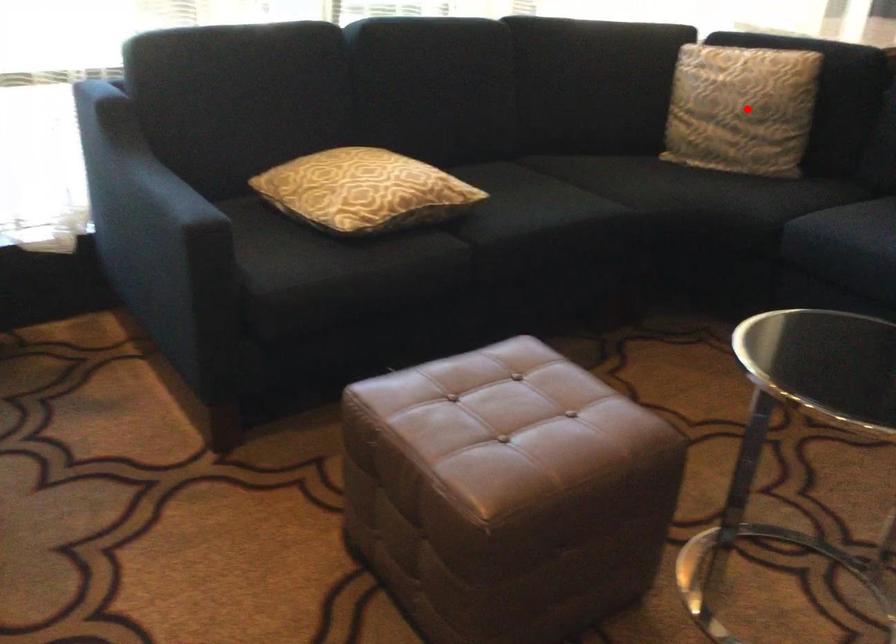
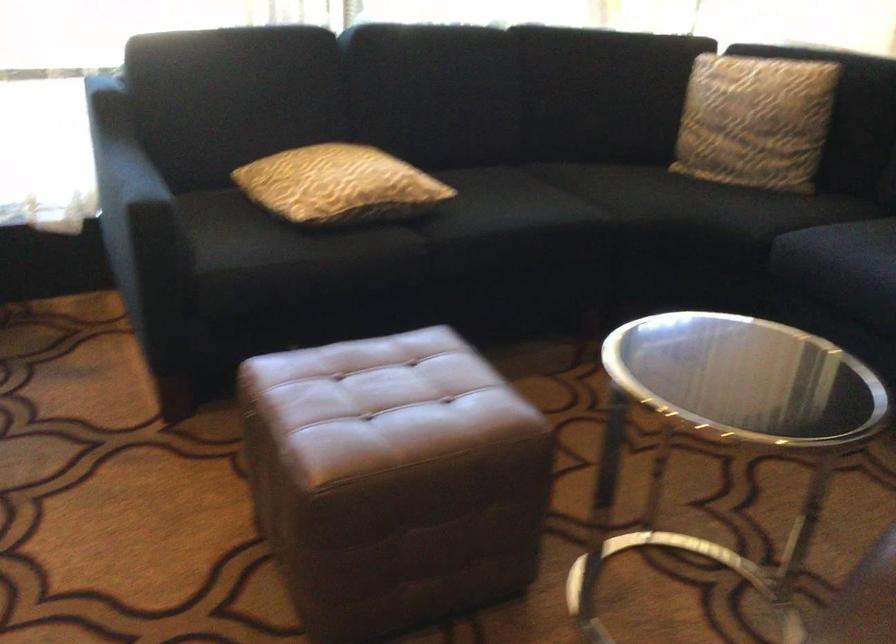
In the second image, find the point that corresponds to the highlighted location in the first image.

(754, 120)